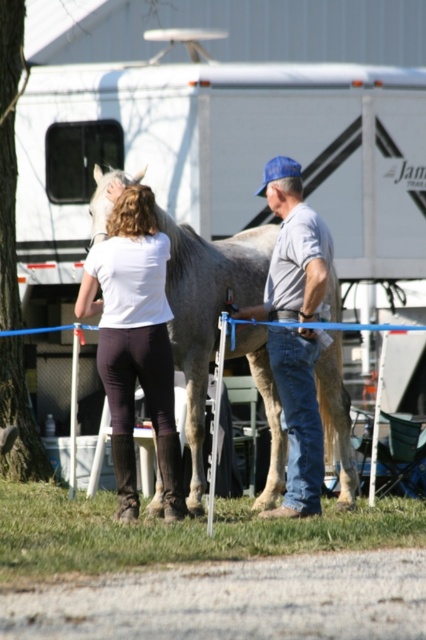
You are a photographer trying to capture a closeup of the gray matte horse at center and the matte white shirt at center. Which object should you focus on first if you want to ensure both are in focus?

The gray matte horse at center is larger in size than the matte white shirt at center, so you should focus on the gray matte horse at center first to ensure both are in focus.

You are a photographer positioned to the left of the gray matte horse at center and want to capture a closeup of the gray denim jeans at center. Can you move closer to the horse to get a better shot without moving the horse?

The gray matte horse at center is wider than the gray denim jeans at center, so moving closer might not be possible without disturbing the horse as the horse is wider.